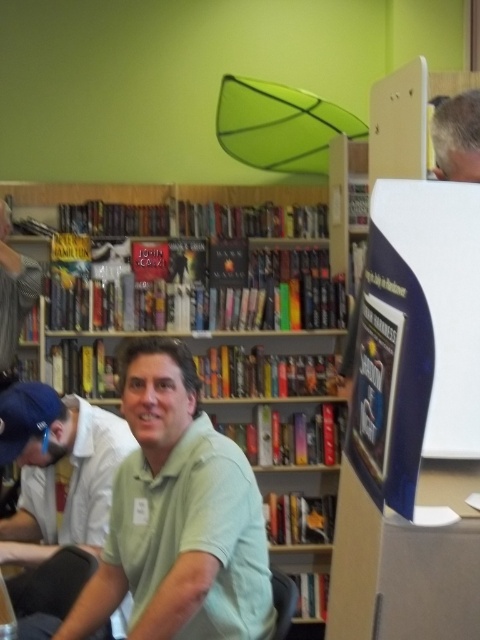
Can you confirm if green matte shirt at center is positioned below gray hair at upper right?

Indeed, green matte shirt at center is positioned under gray hair at upper right.

Who is more forward, (15,436) or (453,97)?

Positioned in front is point (15,436).

Locate an element on the screen. This screenshot has height=640, width=480. green matte shirt at center is located at coordinates (58, 468).

Locate an element on the screen. This screenshot has height=640, width=480. green matte shirt at center is located at coordinates (58, 468).

Between light green polo shirt at center and gray hair at upper right, which one is positioned higher?

gray hair at upper right

Between light green polo shirt at center and gray hair at upper right, which one has more height?

light green polo shirt at center

Who is more forward, (141,429) or (443,140)?

Point (443,140) is more forward.

At what (x,y) coordinates should I click in order to perform the action: click on light green polo shirt at center. Please return your answer as a coordinate pair (x, y). This screenshot has width=480, height=640. Looking at the image, I should click on (179, 516).

Measure the distance from light green polo shirt at center to wooden bookshelf at center.

5.74 feet

Is light green polo shirt at center bigger than wooden bookshelf at center?

Incorrect, light green polo shirt at center is not larger than wooden bookshelf at center.

Find the location of a particular element. This screenshot has height=640, width=480. light green polo shirt at center is located at coordinates (179, 516).